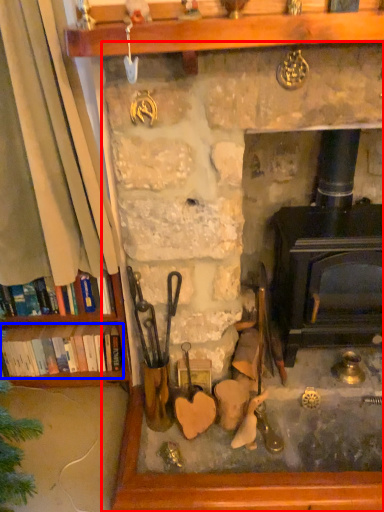
Question: Which object is closer to the camera taking this photo, fireplace (highlighted by a red box) or book (highlighted by a blue box)?

Choices:
 (A) fireplace
 (B) book

Answer: (A)